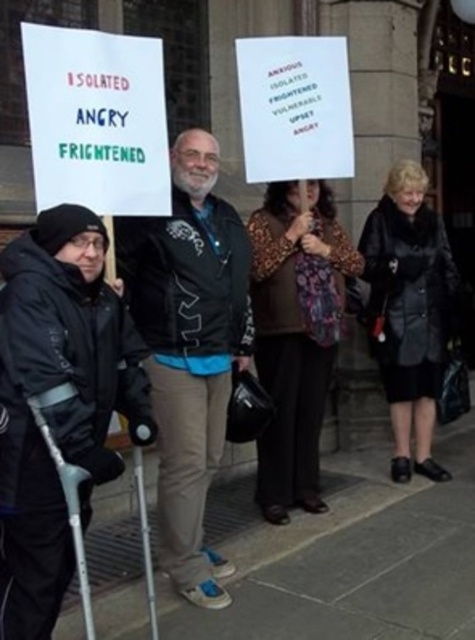
Between gray concrete pavement at lower center and black matte jacket at center, which one is positioned lower?

gray concrete pavement at lower center is below.

Is gray concrete pavement at lower center positioned at the back of black matte jacket at center?

No, it is in front of black matte jacket at center.

Between point (244, 593) and point (196, 602), which one is positioned in front?

Point (196, 602)

The width and height of the screenshot is (475, 640). I want to click on gray concrete pavement at lower center, so click(x=349, y=556).

Looking at this image, which is more to the right, black matte jacket at center or leopard print scarf at center?

leopard print scarf at center

Is point (199, 337) closer to viewer compared to point (291, 352)?

Yes, point (199, 337) is in front of point (291, 352).

Find the location of a particular element. black matte jacket at center is located at coordinates (189, 348).

Does gray concrete pavement at lower center have a larger size compared to leopard print scarf at center?

Correct, gray concrete pavement at lower center is larger in size than leopard print scarf at center.

Is point (408, 580) behind point (326, 220)?

No.

Between point (297, 600) and point (313, 508), which one is positioned behind?

Point (313, 508)

The height and width of the screenshot is (640, 475). What are the coordinates of `gray concrete pavement at lower center` in the screenshot? It's located at (349, 556).